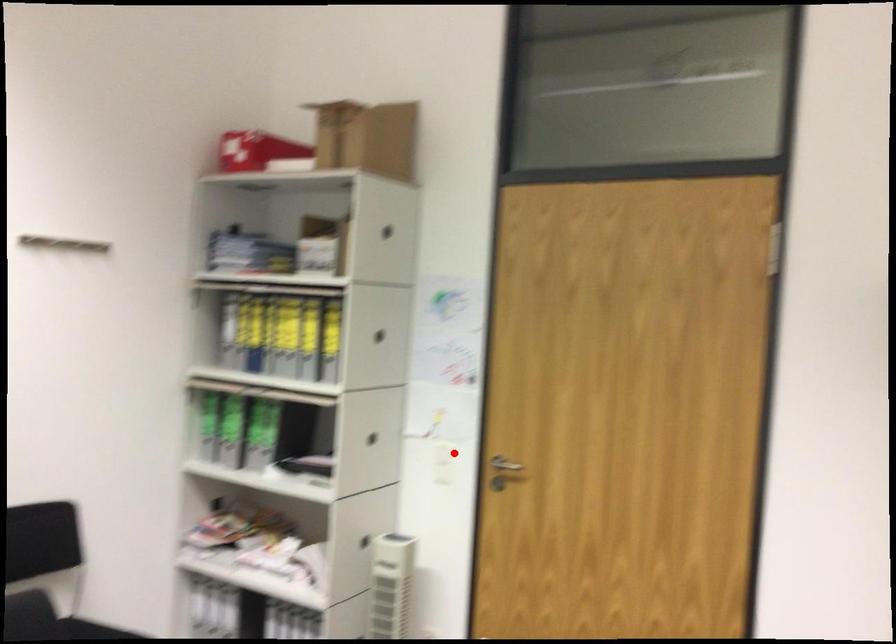
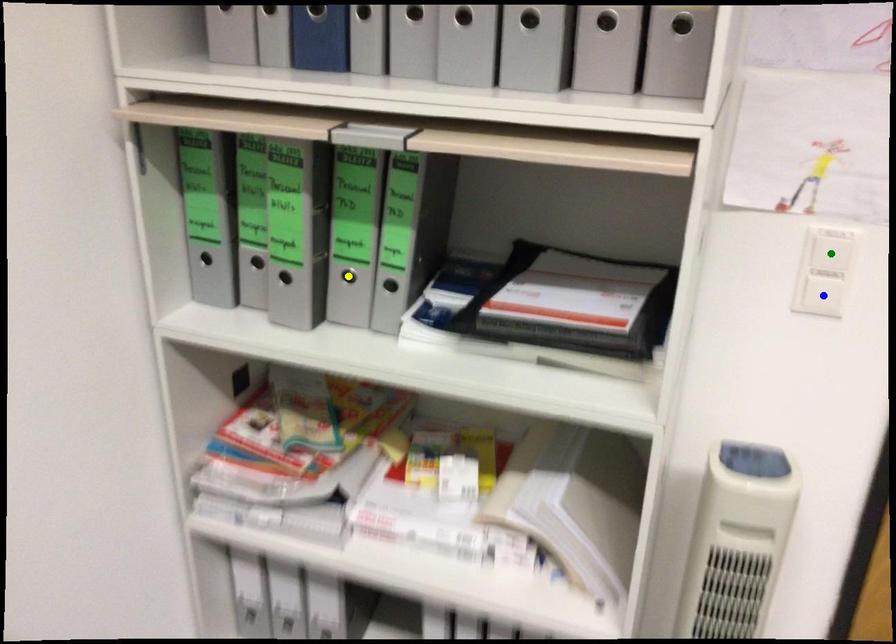
Question: I am providing you with two images of the same scene from different viewpoints. A red point is marked on the first image. You are given multiple points on the second image. Which mark in image 2 goes with the point in image 1?

Choices:
 (A) green point
 (B) yellow point
 (C) blue point

Answer: (A)